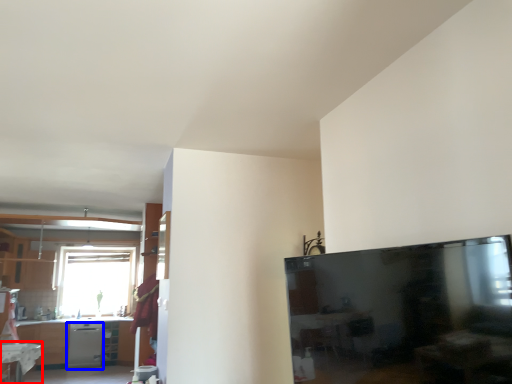
Question: Which object is closer to the camera taking this photo, table (highlighted by a red box) or dish washer (highlighted by a blue box)?

Choices:
 (A) table
 (B) dish washer

Answer: (A)